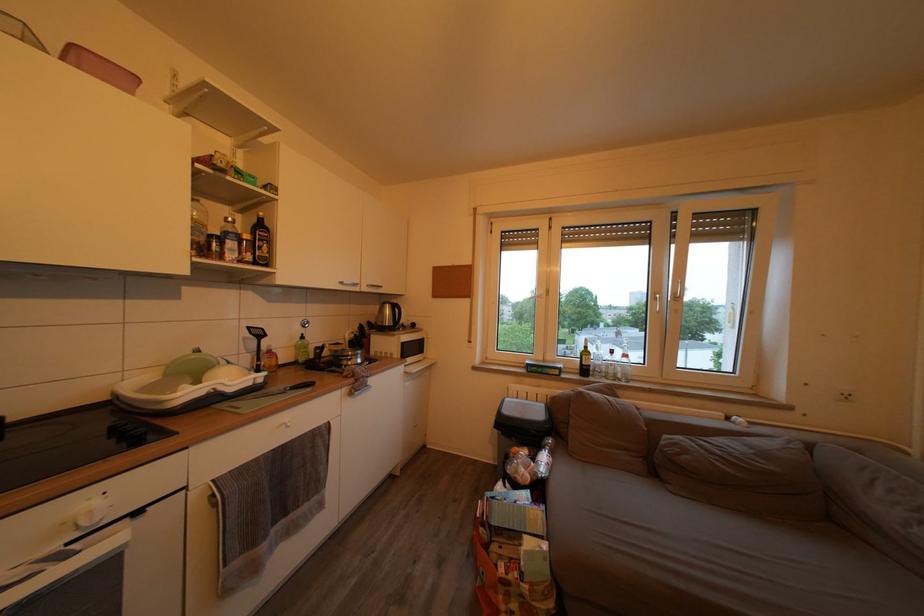
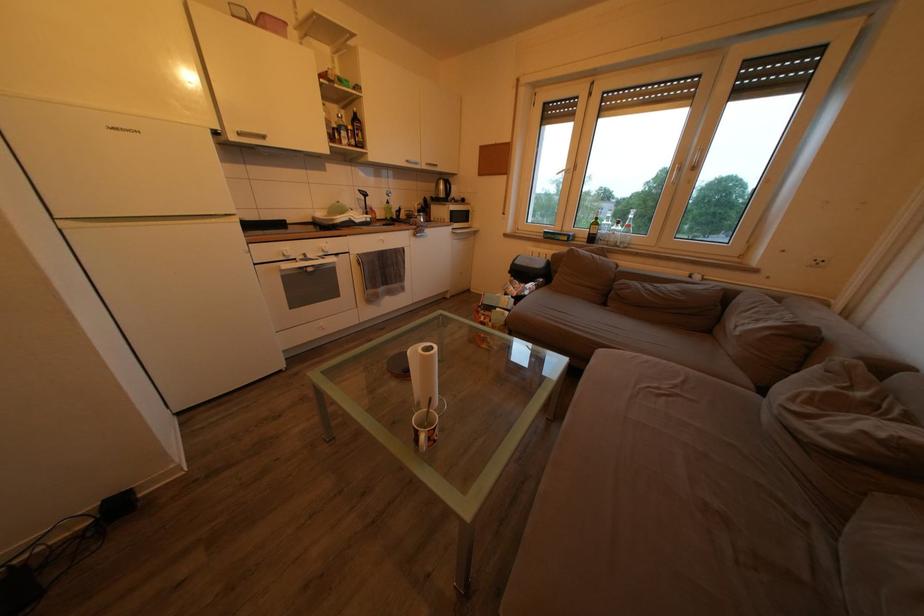
The images are taken continuously from a first-person perspective. In which direction is your viewpoint rotating?

The camera rotated toward left-down.